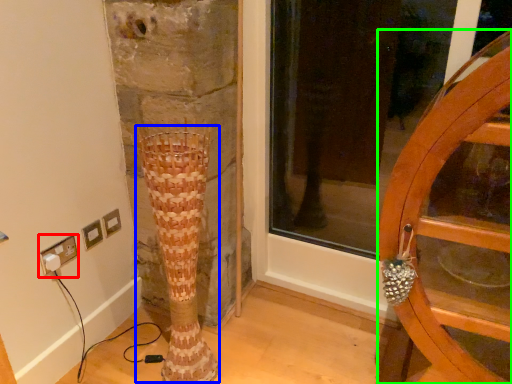
Question: Which object is the farthest from electric outlet (highlighted by a red box)? Choose among these: tree trunk (highlighted by a blue box) or furniture (highlighted by a green box).

Choices:
 (A) tree trunk
 (B) furniture

Answer: (B)